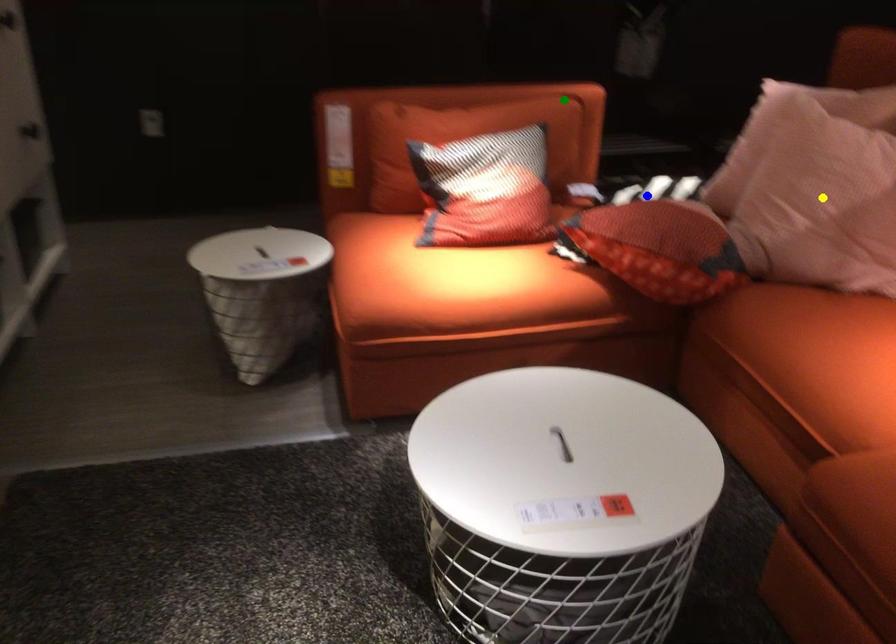
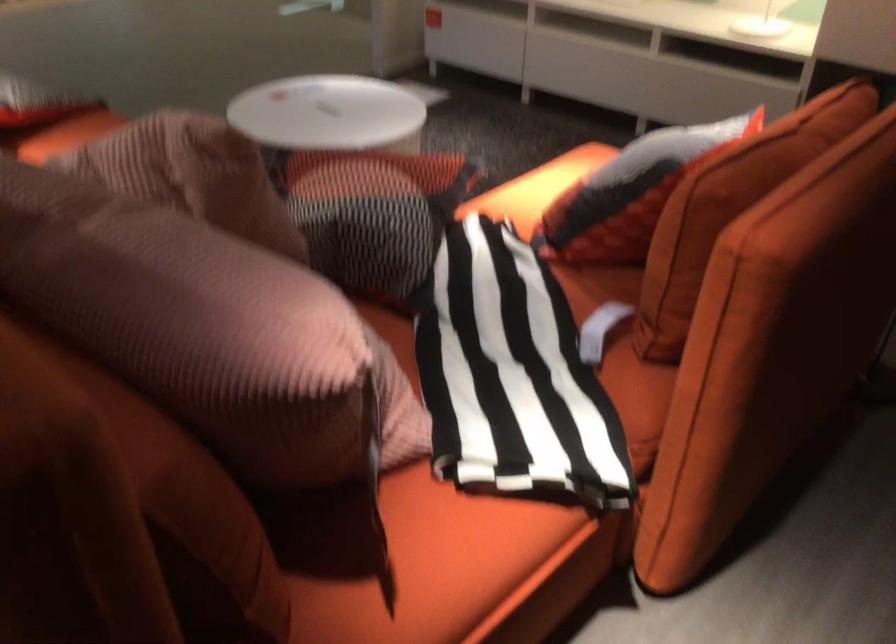
I am providing you with two images of the same scene from different viewpoints. Three points are marked in image1. Which point corresponds to a part or object that is occluded in image2?In image1, three points are marked. Which of them correspond to a part or object that is occluded in image2?Among the three points shown in image1, which one corresponds to a part or object that is no longer visible due to occlusion in image2?

Invisible in image2: yellow point.